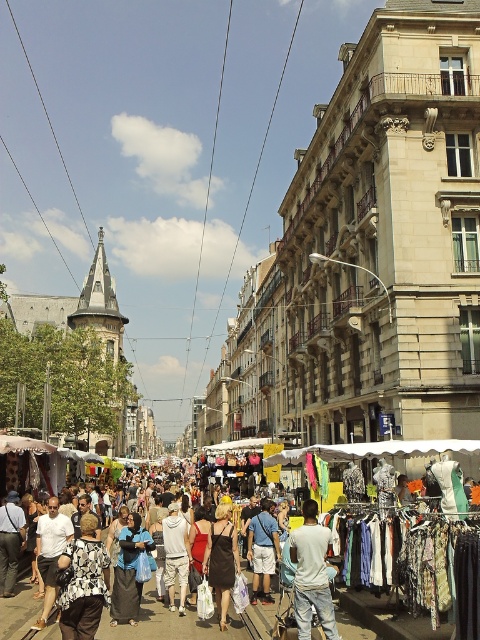
Question: Is white fabric clothing at center closer to camera compared to dark blue fabric at center?

Choices:
 (A) no
 (B) yes

Answer: (B)

Question: Is white fabric clothing at center to the left of black fabric dress at center from the viewer's perspective?

Choices:
 (A) no
 (B) yes

Answer: (A)

Question: Is black fabric dress at center in front of light blue denim shorts at center?

Choices:
 (A) yes
 (B) no

Answer: (A)

Question: Considering the real-world distances, which object is farthest from the floral-patterned dress at center?

Choices:
 (A) white cotton shirt at center
 (B) white fabric clothing at center

Answer: (A)

Question: Based on their relative distances, which object is farther from the light blue denim shorts at center?

Choices:
 (A) black fabric dress at center
 (B) dark blue fabric at center
 (C) white cotton shirt at center

Answer: (B)

Question: Estimate the real-world distances between objects in this image. Which object is closer to the white cotton shirt at center?

Choices:
 (A) black fabric dress at center
 (B) floral-patterned dress at center

Answer: (A)